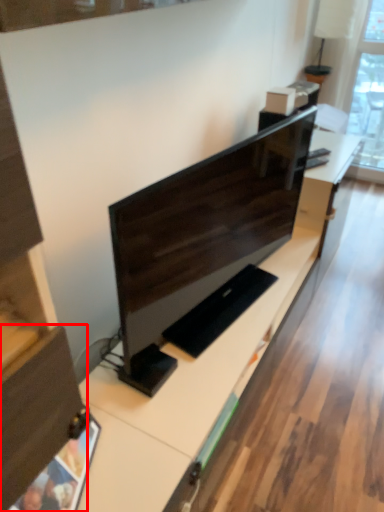
Question: From the image, what is the correct spatial relationship of drawer (annotated by the red box) in relation to computer monitor?

Choices:
 (A) right
 (B) left

Answer: (B)